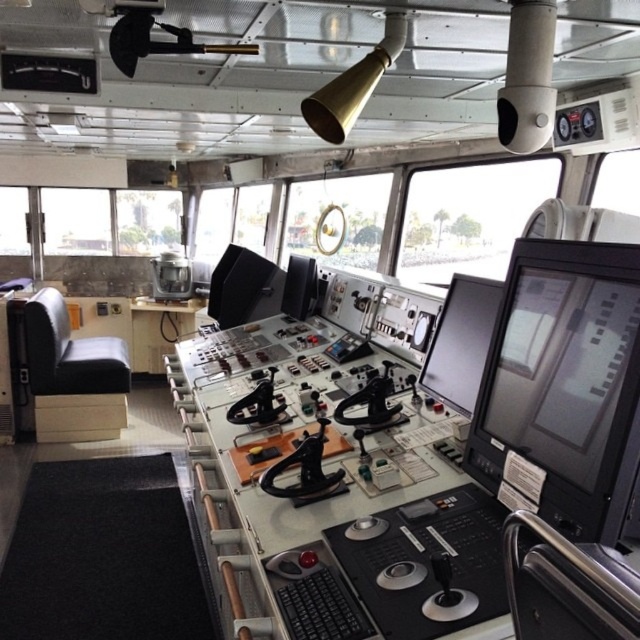
Question: Is black glossy monitor at center right positioned behind matte black monitor at center?

Choices:
 (A) no
 (B) yes

Answer: (A)

Question: Based on their relative distances, which object is nearer to the matte black monitor at center?

Choices:
 (A) black glossy monitor at center right
 (B) black glossy monitor at center

Answer: (B)

Question: Is black glossy monitor at center positioned in front of matte black monitor at center?

Choices:
 (A) yes
 (B) no

Answer: (A)

Question: Which object appears closest to the camera in this image?

Choices:
 (A) black glossy monitor at center
 (B) black glossy monitor at center right

Answer: (B)

Question: Considering the relative positions of black glossy monitor at center right and black glossy monitor at center in the image provided, where is black glossy monitor at center right located with respect to black glossy monitor at center?

Choices:
 (A) above
 (B) below

Answer: (B)

Question: Which point is closer to the camera?

Choices:
 (A) black glossy monitor at center
 (B) matte black monitor at center
 (C) black glossy monitor at center right

Answer: (C)